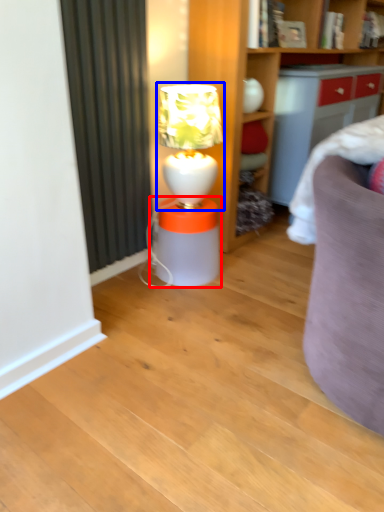
Question: Among these objects, which one is farthest to the camera, table (highlighted by a red box) or table lamp (highlighted by a blue box)?

Choices:
 (A) table
 (B) table lamp

Answer: (A)